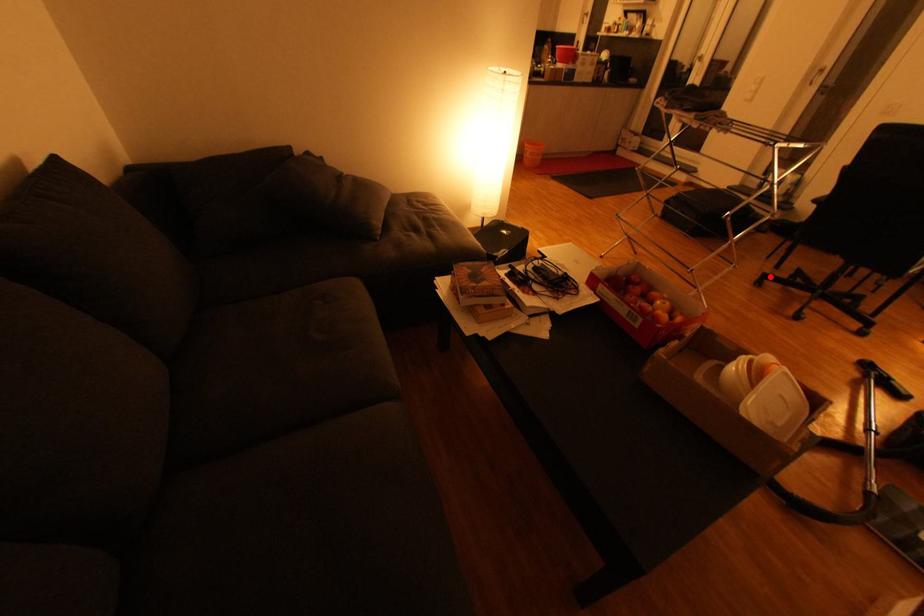
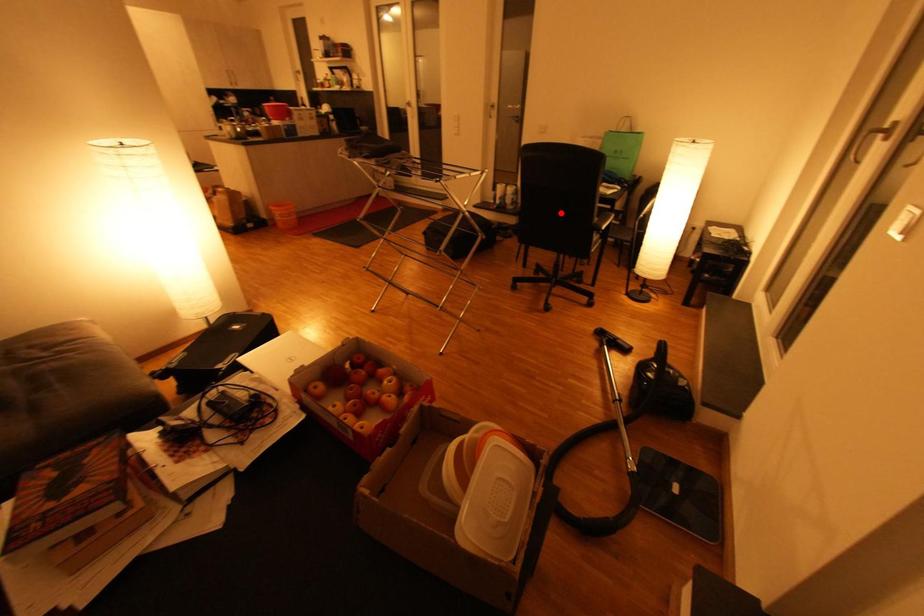
I am providing you with two images of the same scene from different viewpoints. A red point is marked on the first image and another point is marked on the second image. Are the points marked in image1 and image2 representing the same 3D position?

No